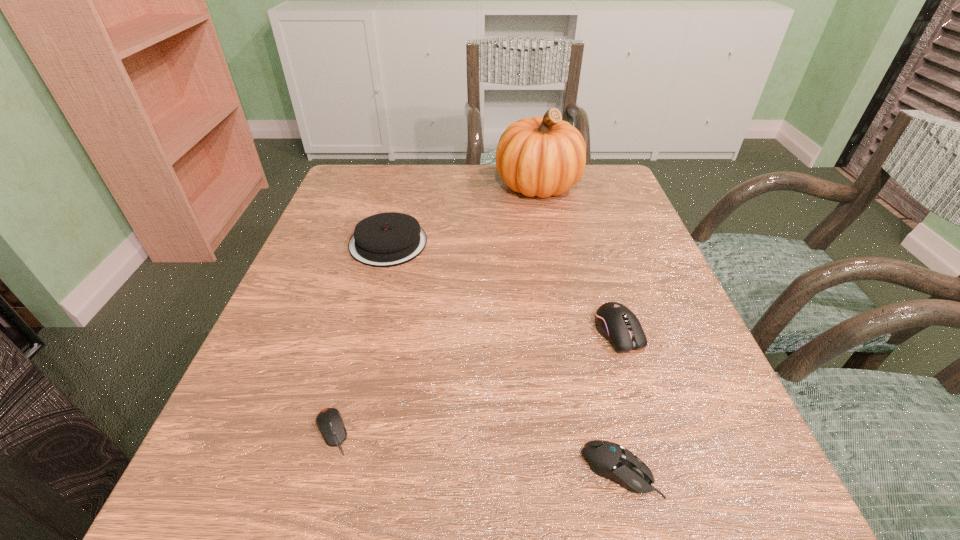
Point out which computer mouse is positioned as the nearest to the second shortest object. Please provide its 2D coordinates. Your answer should be formatted as a tuple, i.e. [(x, y)], where the tuple contains the x and y coordinates of a point satisfying the conditions above.

[(617, 323)]